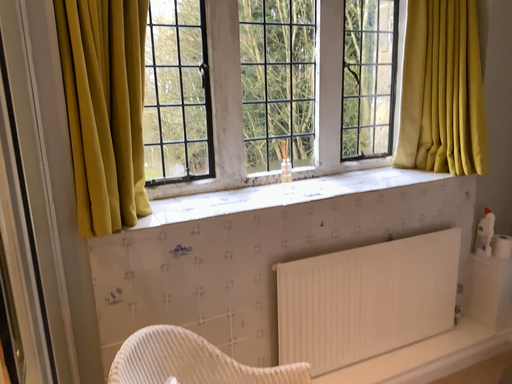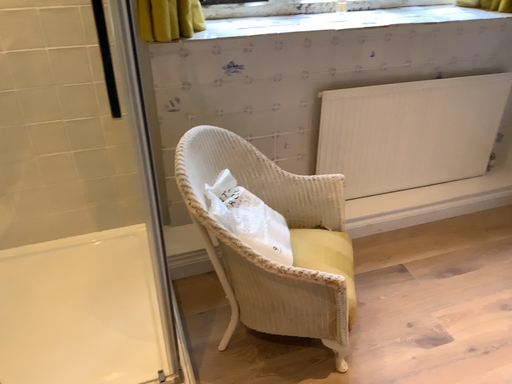
Question: Which way did the camera rotate in the video?

Choices:
 (A) rotated upward
 (B) rotated downward

Answer: (B)